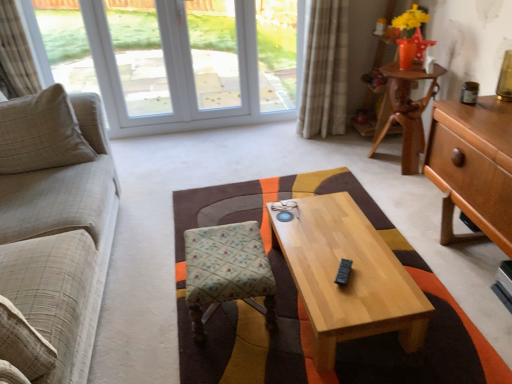
Question: Is wooden desk at upper right, which is the 1th desk in back-to-front order, bigger than light brown wood desk at right, which appears as the first desk when viewed from the front?

Choices:
 (A) yes
 (B) no

Answer: (B)

Question: Is wooden desk at upper right, which is the 1th desk in back-to-front order, positioned with its back to light brown wood desk at right, which is the second desk in back-to-front order?

Choices:
 (A) no
 (B) yes

Answer: (A)

Question: Is the depth of wooden desk at upper right, which is the 1th desk in back-to-front order, less than that of light brown wood desk at right, which is the second desk in back-to-front order?

Choices:
 (A) no
 (B) yes

Answer: (A)

Question: From a real-world perspective, is wooden desk at upper right, which ranks as the second desk in front-to-back order, on top of light brown wood desk at right, which is the second desk in back-to-front order?

Choices:
 (A) yes
 (B) no

Answer: (B)

Question: From the image's perspective, is wooden desk at upper right, which ranks as the second desk in front-to-back order, over light brown wood desk at right, which is the second desk in back-to-front order?

Choices:
 (A) yes
 (B) no

Answer: (A)

Question: Considering the relative sizes of wooden desk at upper right, which ranks as the second desk in front-to-back order, and light brown wood desk at right, which is the second desk in back-to-front order, in the image provided, is wooden desk at upper right, which ranks as the second desk in front-to-back order, smaller than light brown wood desk at right, which is the second desk in back-to-front order,?

Choices:
 (A) yes
 (B) no

Answer: (A)

Question: From a real-world perspective, is patterned fabric stool at center located higher than light wood/texture coffee table at center?

Choices:
 (A) no
 (B) yes

Answer: (B)

Question: Considering the relative sizes of patterned fabric stool at center and light wood/texture coffee table at center in the image provided, is patterned fabric stool at center shorter than light wood/texture coffee table at center?

Choices:
 (A) no
 (B) yes

Answer: (A)

Question: From the image's perspective, is patterned fabric stool at center on top of light wood/texture coffee table at center?

Choices:
 (A) no
 (B) yes

Answer: (A)

Question: From a real-world perspective, is patterned fabric stool at center located beneath light wood/texture coffee table at center?

Choices:
 (A) no
 (B) yes

Answer: (A)

Question: Considering the relative positions of patterned fabric stool at center and light wood/texture coffee table at center in the image provided, is patterned fabric stool at center behind light wood/texture coffee table at center?

Choices:
 (A) yes
 (B) no

Answer: (A)

Question: Can you confirm if patterned fabric stool at center is positioned to the left of light wood/texture coffee table at center?

Choices:
 (A) no
 (B) yes

Answer: (B)

Question: Is light wood/texture coffee table at center thinner than light brown wood desk at right, which appears as the first desk when viewed from the front?

Choices:
 (A) no
 (B) yes

Answer: (A)